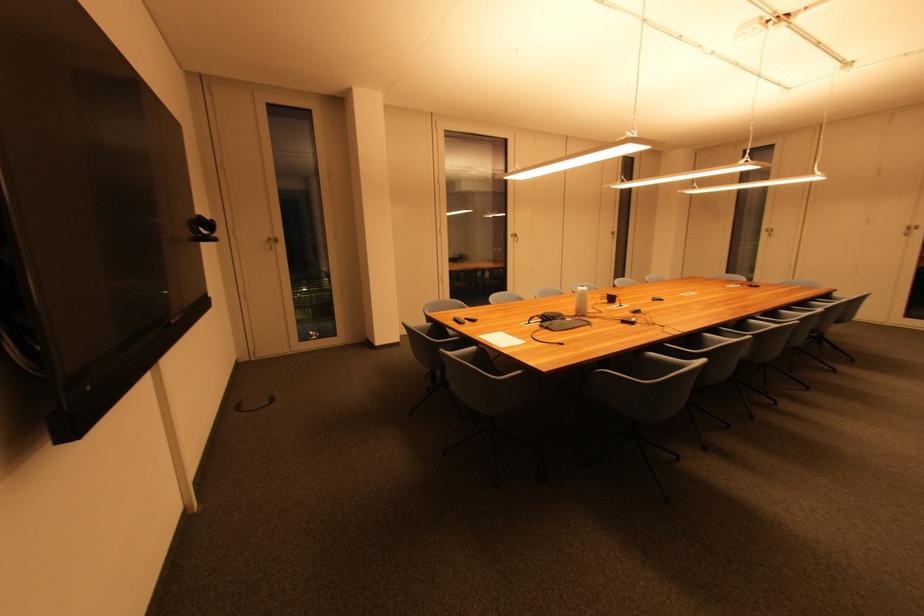
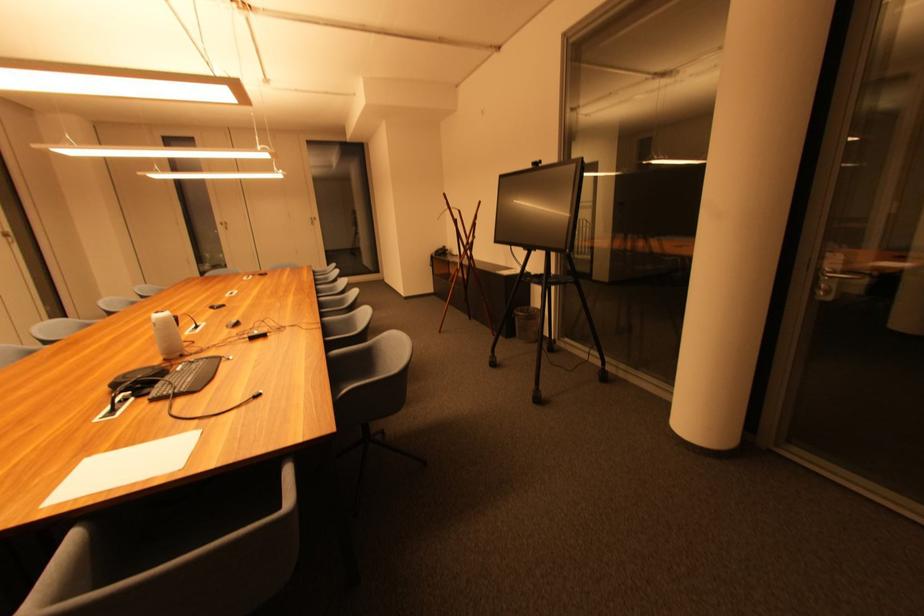
Find the pixel in the second image that matches point 772,232 in the first image.

(226, 225)